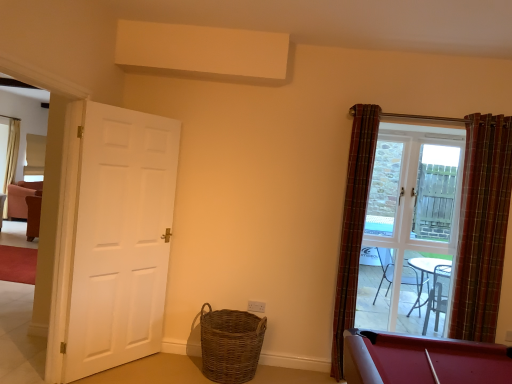
Question: Looking at the image, does plaid fabric curtain at right, which is counted as the first curtain, starting from the right, seem bigger or smaller compared to white matte door at left?

Choices:
 (A) small
 (B) big

Answer: (A)

Question: Considering the positions of plaid fabric curtain at right, placed as the 2th curtain when sorted from left to right, and white matte door at left in the image, is plaid fabric curtain at right, placed as the 2th curtain when sorted from left to right, taller or shorter than white matte door at left?

Choices:
 (A) tall
 (B) short

Answer: (B)

Question: Which object is positioned farthest from the plaid fabric curtain at right, which is counted as the first curtain, starting from the right?

Choices:
 (A) white matte door at left
 (B) clear glass door at right
 (C) woven brown basket at lower center
 (D) plaid fabric curtain at right, which is counted as the first curtain, starting from the left

Answer: (A)

Question: Considering the real-world distances, which object is closest to the woven brown basket at lower center?

Choices:
 (A) plaid fabric curtain at right, which is counted as the first curtain, starting from the right
 (B) white matte door at left
 (C) plaid fabric curtain at right, which is counted as the first curtain, starting from the left
 (D) clear glass door at right

Answer: (B)